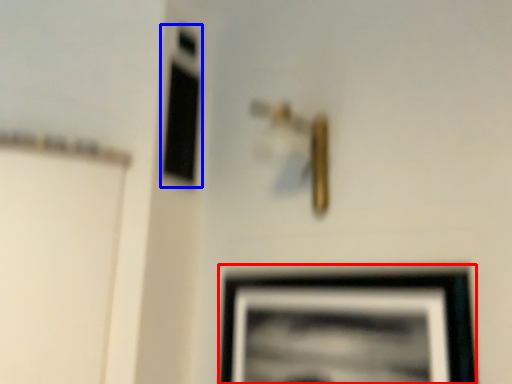
Question: Which object is further to the camera taking this photo, picture frame (highlighted by a red box) or window (highlighted by a blue box)?

Choices:
 (A) picture frame
 (B) window

Answer: (B)